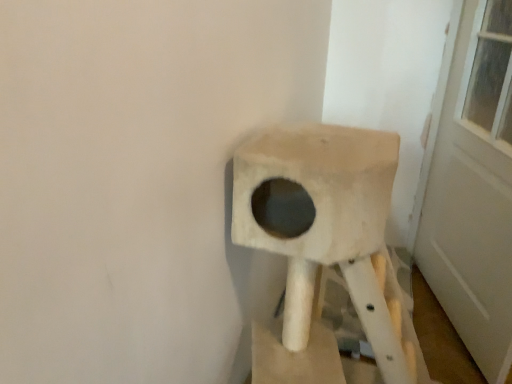
Question: Is white matte door at upper right wider than beige fabric cat tree at center?

Choices:
 (A) yes
 (B) no

Answer: (B)

Question: Considering the relative positions of white matte door at upper right and beige fabric cat tree at center in the image provided, is white matte door at upper right to the right of beige fabric cat tree at center from the viewer's perspective?

Choices:
 (A) yes
 (B) no

Answer: (A)

Question: Does white matte door at upper right come behind beige fabric cat tree at center?

Choices:
 (A) no
 (B) yes

Answer: (B)

Question: Could beige fabric cat tree at center be considered to be inside white matte door at upper right?

Choices:
 (A) yes
 (B) no

Answer: (B)

Question: Is white matte door at upper right positioned before beige fabric cat tree at center?

Choices:
 (A) yes
 (B) no

Answer: (B)

Question: Is white matte door at upper right not inside beige fabric cat tree at center?

Choices:
 (A) yes
 (B) no

Answer: (A)

Question: Is there a large distance between beige fabric cat tree at center and white matte door at upper right?

Choices:
 (A) no
 (B) yes

Answer: (A)

Question: Is beige fabric cat tree at center not within white matte door at upper right?

Choices:
 (A) no
 (B) yes

Answer: (B)

Question: From the image's perspective, is beige fabric cat tree at center below white matte door at upper right?

Choices:
 (A) yes
 (B) no

Answer: (A)

Question: Is beige fabric cat tree at center with white matte door at upper right?

Choices:
 (A) yes
 (B) no

Answer: (B)

Question: From a real-world perspective, is beige fabric cat tree at center below white matte door at upper right?

Choices:
 (A) no
 (B) yes

Answer: (B)

Question: Is beige fabric cat tree at center aimed at white matte door at upper right?

Choices:
 (A) no
 (B) yes

Answer: (A)

Question: Is beige fabric cat tree at center wider or thinner than white matte door at upper right?

Choices:
 (A) wide
 (B) thin

Answer: (A)